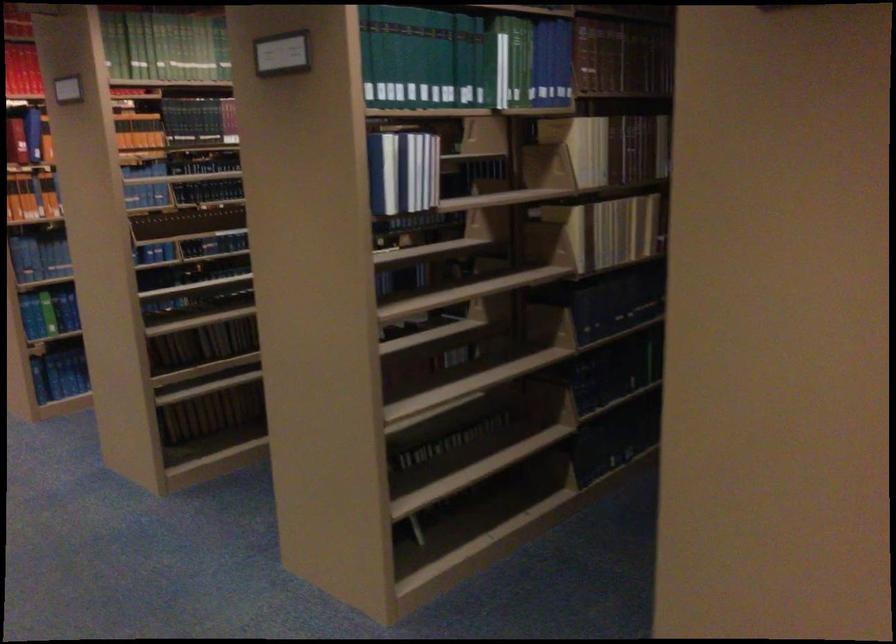
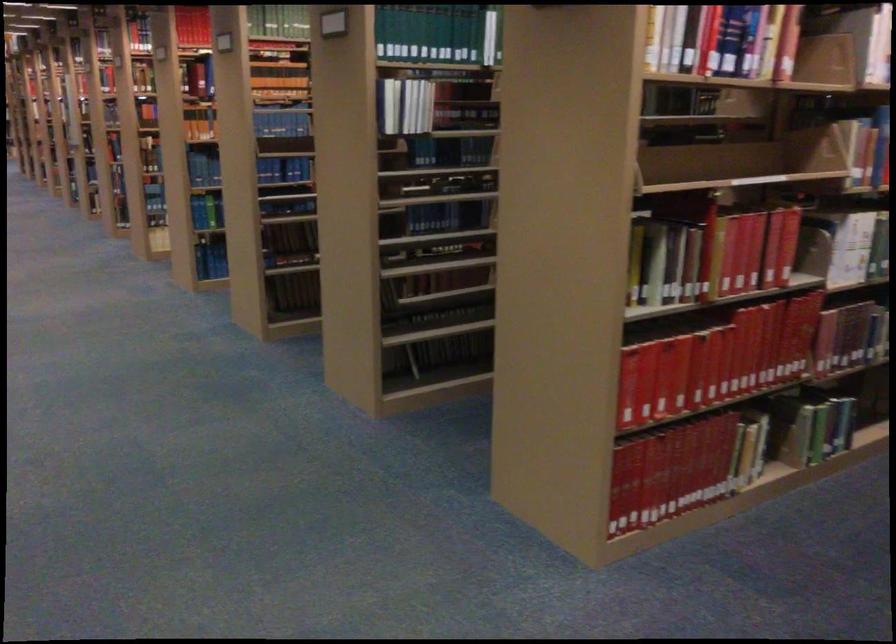
The images are taken continuously from a first-person perspective. In which direction are you moving?

The cameraman walked toward right, backward.